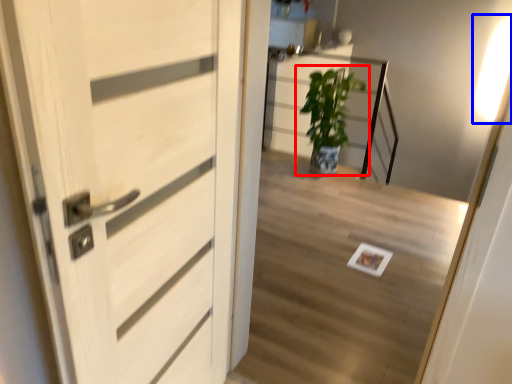
Question: Among these objects, which one is farthest to the camera, houseplant (highlighted by a red box) or light (highlighted by a blue box)?

Choices:
 (A) houseplant
 (B) light

Answer: (B)